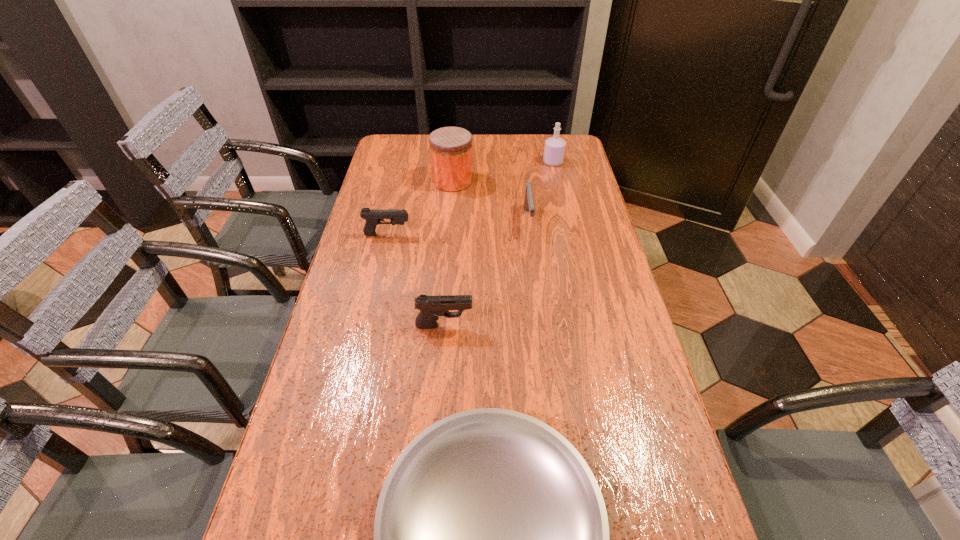
Find the location of a particular element. free space at the far right corner is located at coordinates coord(568,153).

You are a GUI agent. You are given a task and a screenshot of the screen. Output one action in this format:
    pyautogui.click(x=<x>, y=<y>)
    Task: Click on the vacant space that is in between the jar and the nearest pistol
    This screenshot has width=960, height=540.
    Given the screenshot: What is the action you would take?
    pyautogui.click(x=448, y=253)

Locate an element on the screen. vacant region between the rightmost pistol and the fifth nearest object is located at coordinates (491, 200).

You are a GUI agent. You are given a task and a screenshot of the screen. Output one action in this format:
    pyautogui.click(x=<x>, y=<y>)
    Task: Click on the vacant area that lies between the second farthest object and the leftmost object
    This screenshot has width=960, height=540.
    Given the screenshot: What is the action you would take?
    (420, 208)

Identify the location of free space that is in between the leftmost object and the rightmost pistol. This screenshot has height=540, width=960. (x=458, y=227).

Identify the location of free point between the rightmost pistol and the leftmost pistol. (458, 227).

Identify the location of empty space between the perfume and the second farthest object. The image size is (960, 540). (503, 172).

Where is `vacant space that's between the second nearest object and the farthest object`? vacant space that's between the second nearest object and the farthest object is located at coordinates (498, 244).

Find the location of `blank region between the leftmost pistol and the nearest pistol`. blank region between the leftmost pistol and the nearest pistol is located at coordinates (416, 280).

Image resolution: width=960 pixels, height=540 pixels. I want to click on free space that is in between the nearest pistol and the perfume, so click(498, 244).